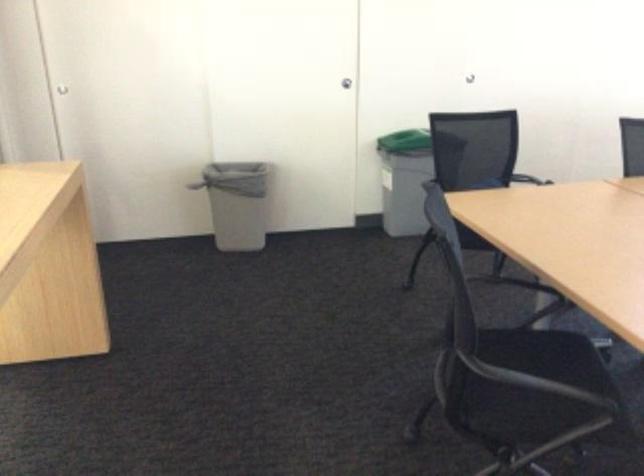
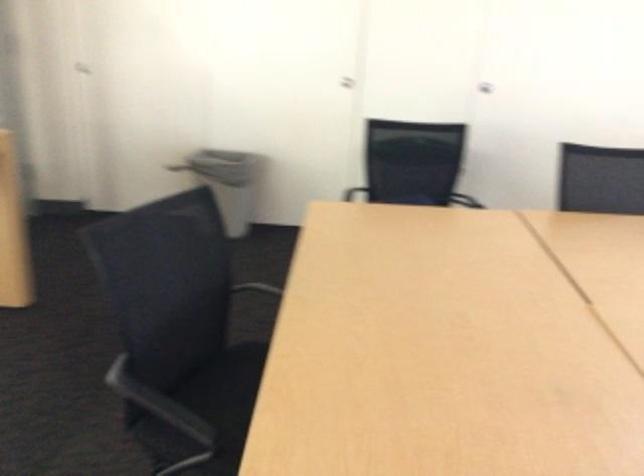
Question: I am providing you with two images of the same scene from different viewpoints. After the viewpoint changes to image2, which objects are now occluded?

Choices:
 (A) blue pump bottle
 (B) black chair armrest
 (C) green trash can lid
 (D) chair sitting surface

Answer: (C)